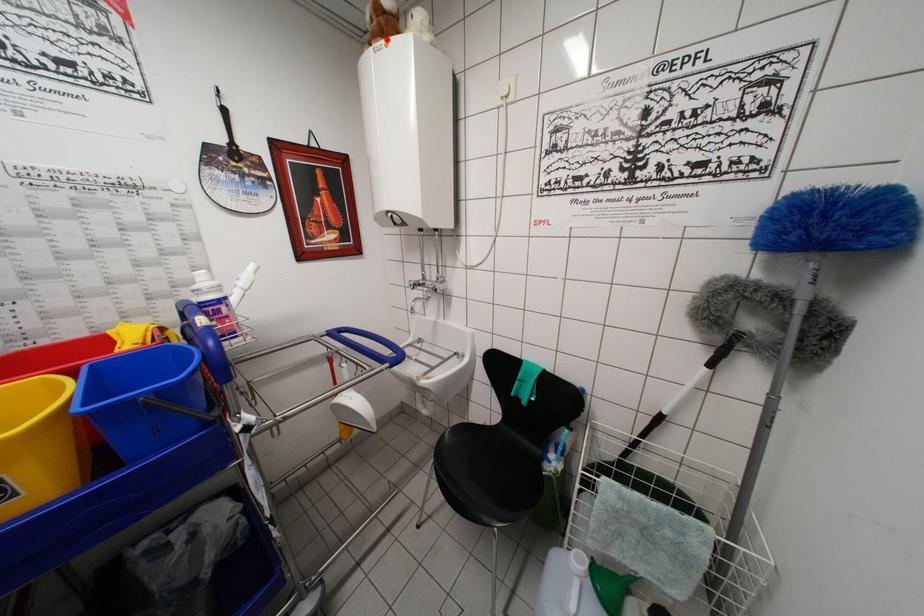
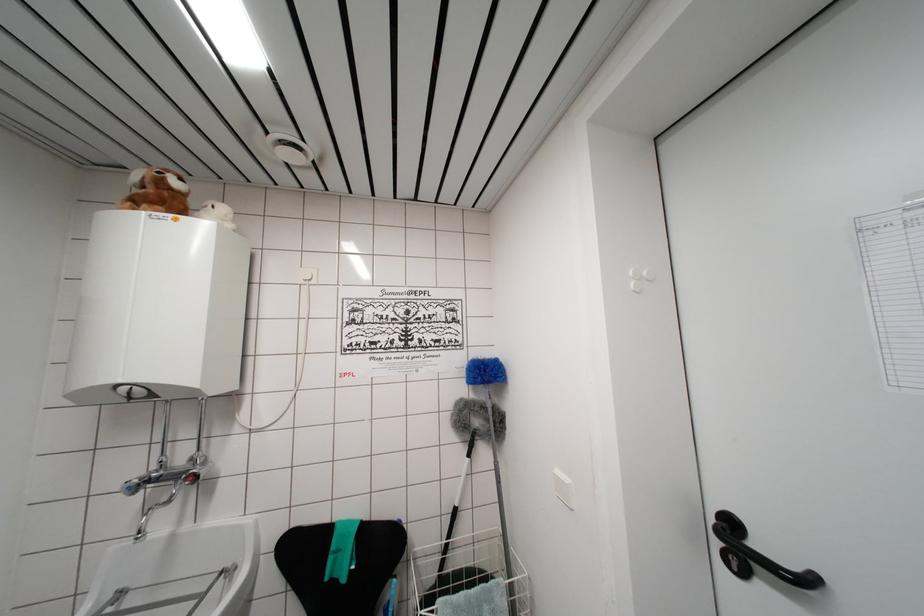
Find the pixel in the second image that matches the highlighted location in the first image.

(168, 209)